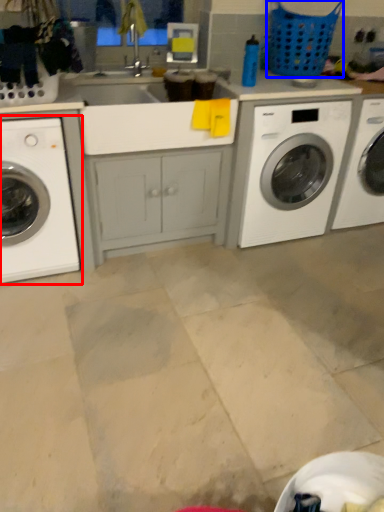
Question: Which point is closer to the camera, washing machine (highlighted by a red box) or basket (highlighted by a blue box)?

Choices:
 (A) washing machine
 (B) basket

Answer: (A)